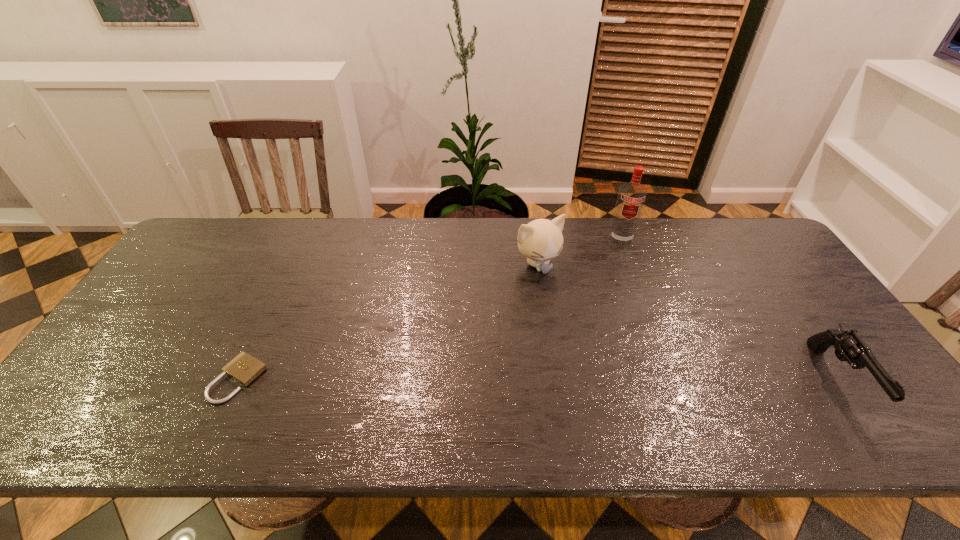
Image resolution: width=960 pixels, height=540 pixels. I want to click on object positioned at the near right corner, so click(x=849, y=346).

In the image, there is a desktop. Where is `vacant region at the far edge`? This screenshot has width=960, height=540. vacant region at the far edge is located at coordinates (606, 217).

Locate an element on the screen. free space at the near edge of the desktop is located at coordinates (338, 392).

You are a GUI agent. You are given a task and a screenshot of the screen. Output one action in this format:
    pyautogui.click(x=<x>, y=<y>)
    Task: Click on the free space at the far left corner of the desktop
    Image resolution: width=960 pixels, height=540 pixels.
    Given the screenshot: What is the action you would take?
    pyautogui.click(x=204, y=261)

You are a GUI agent. You are given a task and a screenshot of the screen. Output one action in this format:
    pyautogui.click(x=<x>, y=<y>)
    Task: Click on the free space at the near left corner of the desktop
    
    Given the screenshot: What is the action you would take?
    (114, 387)

Where is `vacant area at the far right corner of the desktop`? vacant area at the far right corner of the desktop is located at coordinates (736, 222).

Image resolution: width=960 pixels, height=540 pixels. What are the coordinates of `free spot between the second object from left to right and the shortest object` in the screenshot? It's located at [x=388, y=322].

The image size is (960, 540). I want to click on free spot between the second object from right to left and the leftmost object, so click(429, 309).

Where is `free space between the kitten and the gun`? free space between the kitten and the gun is located at coordinates (687, 322).

Locate an element on the screen. free space between the third shortest object and the shortest object is located at coordinates (388, 322).